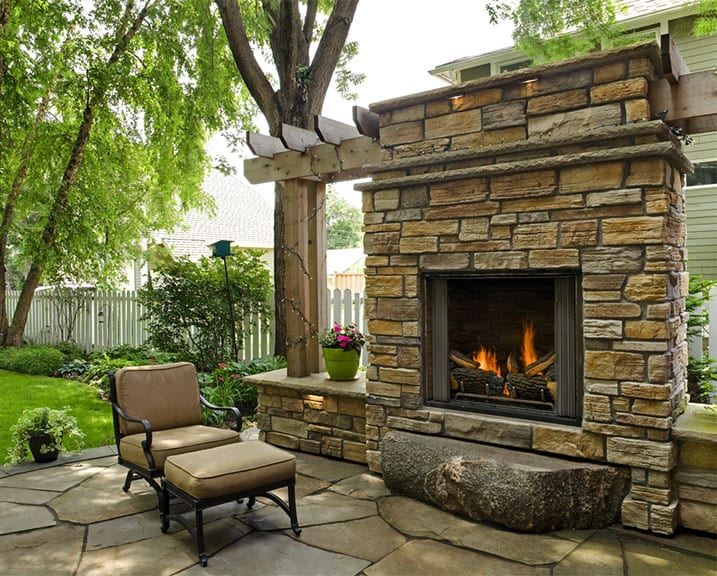
This screenshot has width=717, height=576. What are the coordinates of `ottoman` in the screenshot? It's located at (255, 492).